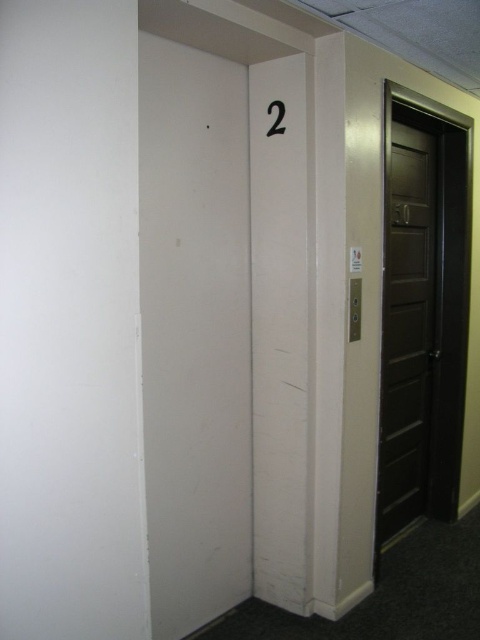
What do you see at coordinates (422, 308) in the screenshot? The image size is (480, 640). I see `dark brown wooden door at right` at bounding box center [422, 308].

Consider the image. Who is positioned more to the right, dark brown wooden door at right or black paper at upper center?

dark brown wooden door at right is more to the right.

Who is more forward, (393, 371) or (268, 134)?

Point (268, 134) is more forward.

Find the location of a particular element. The height and width of the screenshot is (640, 480). dark brown wooden door at right is located at coordinates (422, 308).